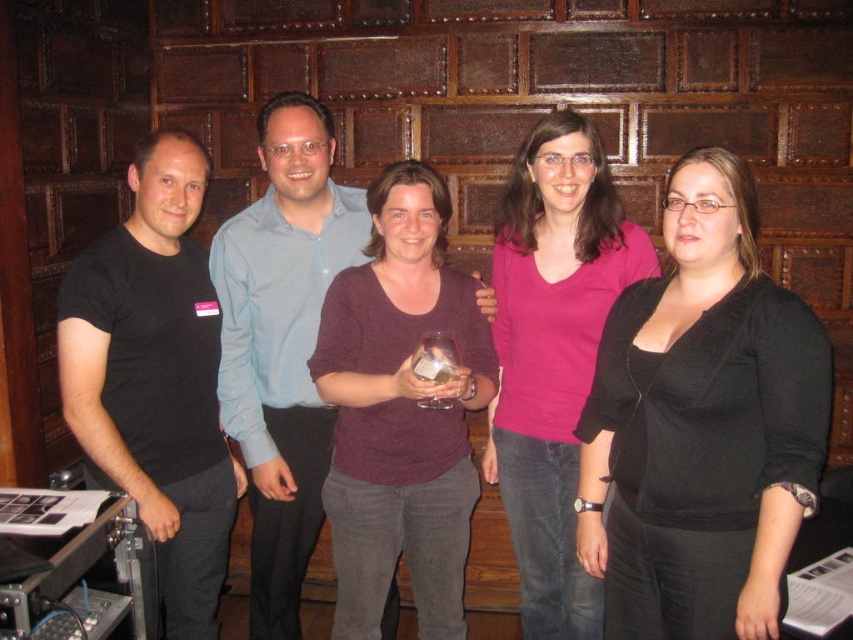
Question: Where is black matte cardigan at center located in relation to maroon sweater at center in the image?

Choices:
 (A) below
 (B) above

Answer: (B)

Question: Which of the following is the closest to the observer?

Choices:
 (A) (434, 349)
 (B) (752, 492)
 (C) (218, 589)

Answer: (B)

Question: Is maroon sweater at center above black matte t-shirt at left?

Choices:
 (A) yes
 (B) no

Answer: (A)

Question: Which point is farther from the camera taking this photo?

Choices:
 (A) (648, 602)
 (B) (57, 333)
 (C) (430, 365)

Answer: (B)

Question: Which of these objects is positioned closest to the maroon sweater at center?

Choices:
 (A) transparent glass at center
 (B) black matte t-shirt at left

Answer: (A)

Question: Does black matte cardigan at center appear on the right side of transparent glass at center?

Choices:
 (A) yes
 (B) no

Answer: (A)